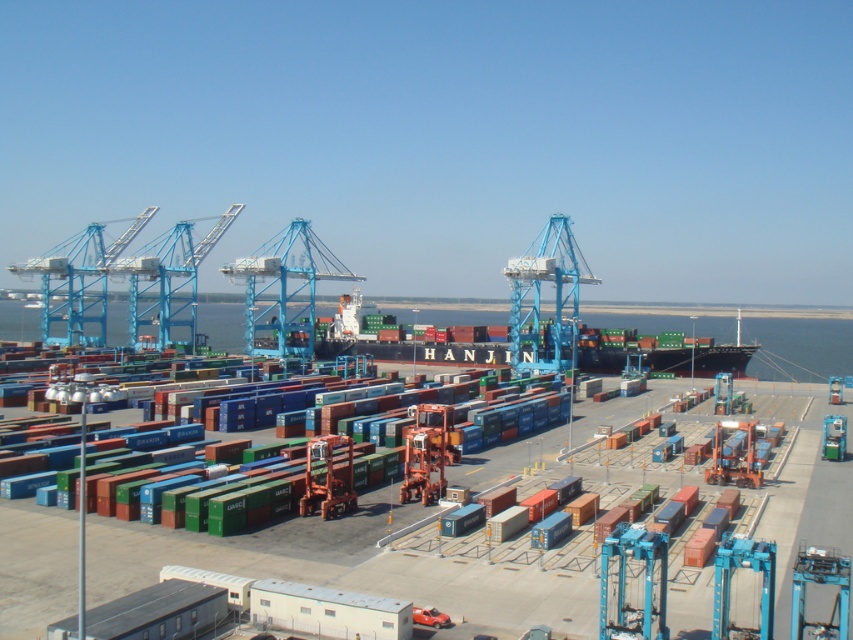
Does black matte water at center have a smaller size compared to green matte container ship at center?

Incorrect, black matte water at center is not smaller in size than green matte container ship at center.

Is point (756, 371) farther from camera compared to point (399, 355)?

Yes, it is.

This screenshot has height=640, width=853. Identify the location of black matte water at center. (799, 348).

Is the position of black matte water at center less distant than that of blue metallic crane at left?

Yes, it is.

Is black matte water at center to the right of blue metallic crane at left from the viewer's perspective?

Correct, you'll find black matte water at center to the right of blue metallic crane at left.

Locate an element on the screen. The width and height of the screenshot is (853, 640). black matte water at center is located at coordinates (799, 348).

Locate an element on the screen. black matte water at center is located at coordinates (799, 348).

Does green matte container ship at center have a lesser width compared to blue metallic crane at left?

Indeed, green matte container ship at center has a lesser width compared to blue metallic crane at left.

Is green matte container ship at center to the left of blue metallic crane at left from the viewer's perspective?

Incorrect, green matte container ship at center is not on the left side of blue metallic crane at left.

Between point (692, 355) and point (85, 333), which one is positioned in front?

Positioned in front is point (692, 355).

What are the coordinates of `green matte container ship at center` in the screenshot? It's located at (407, 339).